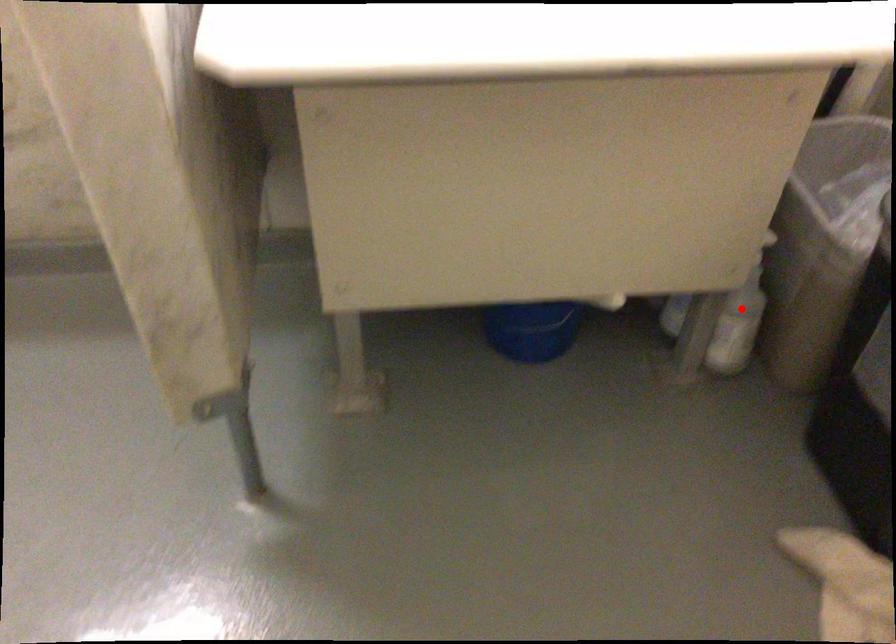
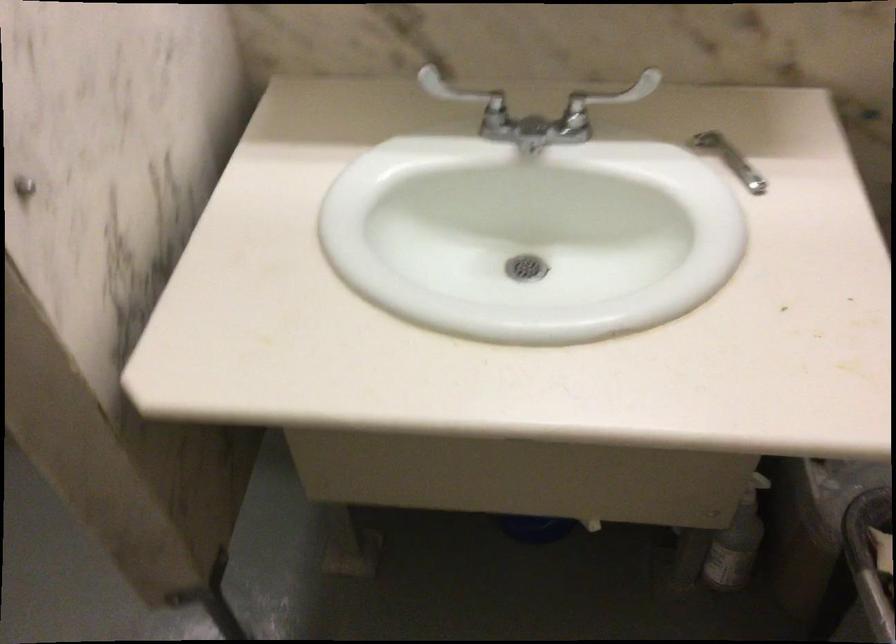
Where in the second image is the point corresponding to the highlighted location from the first image?

(737, 542)